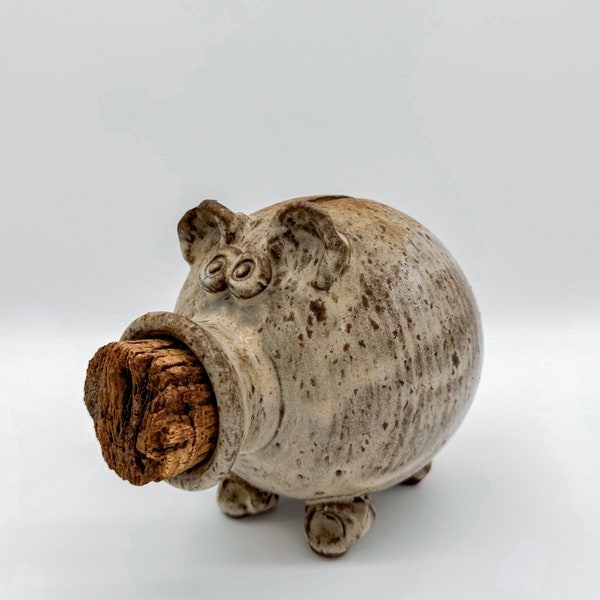
Where is `wall`? The height and width of the screenshot is (600, 600). wall is located at coordinates (324, 110).